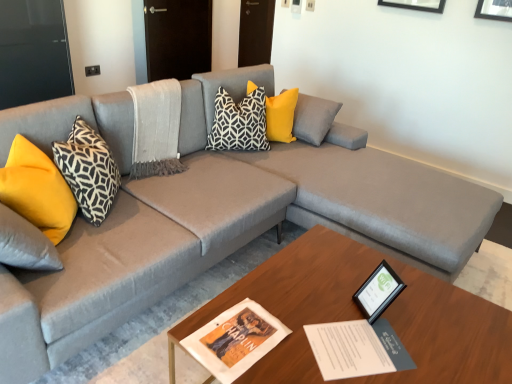
Locate an element on the screen. This screenshot has height=384, width=512. free location to the right of white paper booklet at center is located at coordinates (426, 342).